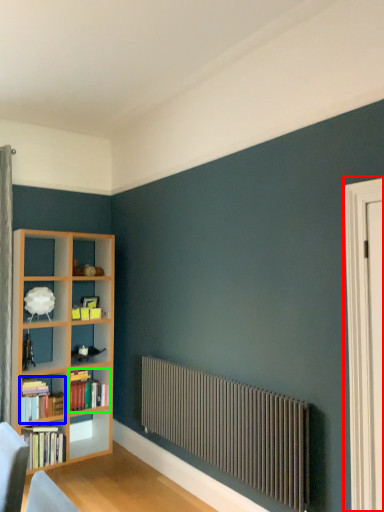
Question: Estimate the real-world distances between objects in this image. Which object is closer to screen door (highlighted by a red box), book (highlighted by a blue box) or book (highlighted by a green box)?

Choices:
 (A) book
 (B) book

Answer: (B)